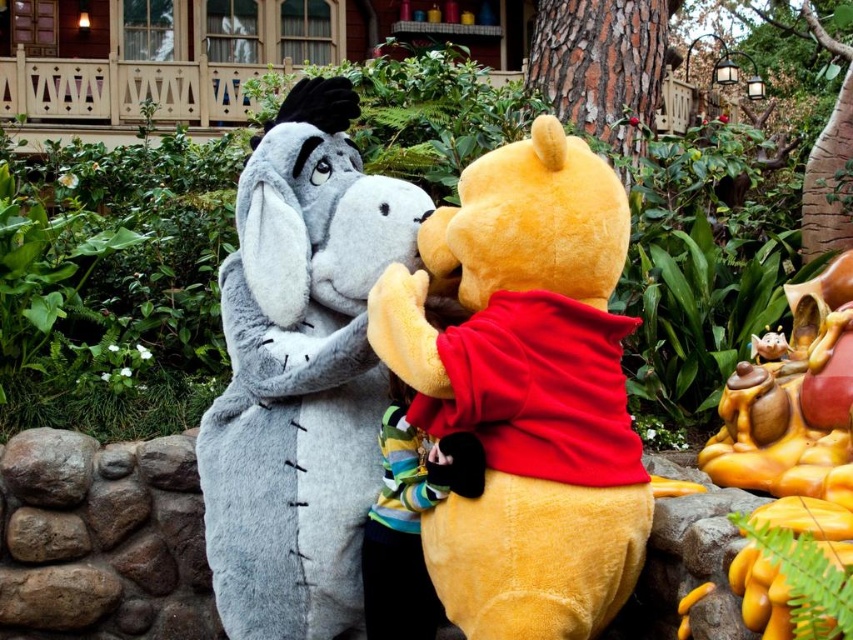
Who is higher up, fluffy gray donkey at center or smooth yellow statue at right?

fluffy gray donkey at center is higher up.

Which is more to the left, fluffy gray donkey at center or smooth yellow statue at right?

From the viewer's perspective, fluffy gray donkey at center appears more on the left side.

Between point (248, 358) and point (804, 385), which one is positioned in front?

Point (248, 358) is in front.

Locate an element on the screen. This screenshot has width=853, height=640. fluffy gray donkey at center is located at coordinates (300, 372).

How much distance is there between fluffy yellow bear at center and fluffy gray donkey at center?

13.43 feet

This screenshot has height=640, width=853. Identify the location of fluffy yellow bear at center. (527, 390).

Is point (538, 496) positioned in front of point (286, 508)?

Yes, point (538, 496) is closer to viewer.

Find the location of `fluffy yellow bear at center`. fluffy yellow bear at center is located at coordinates point(527,390).

Is smooth yellow statue at right bigger than striped fabric shirt at center?

Indeed, smooth yellow statue at right has a larger size compared to striped fabric shirt at center.

Can you confirm if smooth yellow statue at right is thinner than striped fabric shirt at center?

No.

Identify the location of smooth yellow statue at right. This screenshot has height=640, width=853. (795, 417).